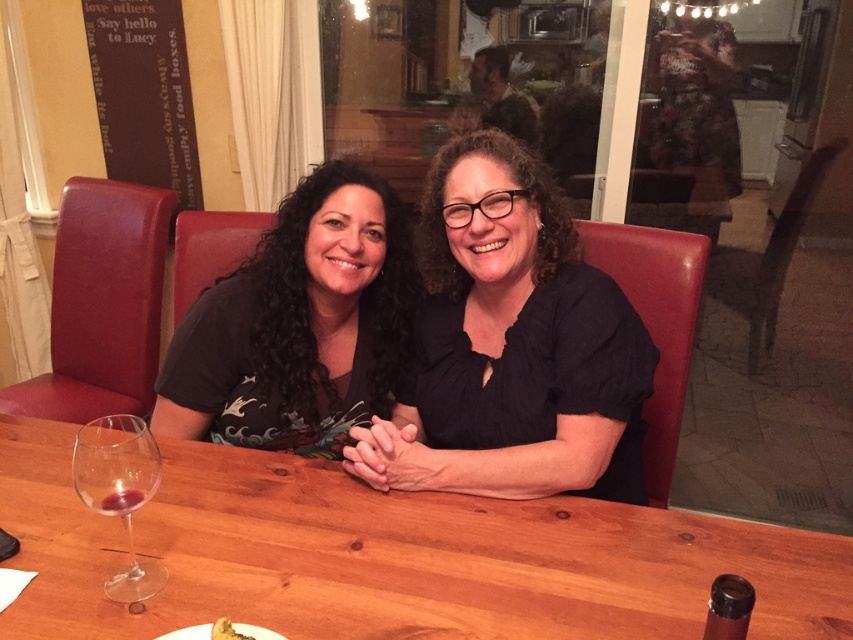
Does brown paper at upper left lie behind clear glass wine at lower left?

Yes, it is.

Does brown paper at upper left have a lesser width compared to clear glass wine at lower left?

No.

At what (x,y) coordinates should I click in order to perform the action: click on brown paper at upper left. Please return your answer as a coordinate pair (x, y). Looking at the image, I should click on (143, 93).

Is black matte shirt at center above brown paper at upper left?

Incorrect, black matte shirt at center is not positioned above brown paper at upper left.

Who is more distant from viewer, (450,188) or (109,49)?

Point (109,49)

Between point (544, 266) and point (109, 160), which one is positioned behind?

The point (109, 160) is more distant.

Locate an element on the screen. black matte shirt at center is located at coordinates (512, 346).

Which is more to the right, matte black shirt at center or brown paper at upper left?

→ matte black shirt at center is more to the right.

Is point (378, 240) in front of point (169, 49)?

Yes, it is in front of point (169, 49).

Is point (256, 262) positioned behind point (164, 88)?

No, (256, 262) is in front of (164, 88).

Identify the location of matte black shirt at center. The image size is (853, 640). (299, 324).